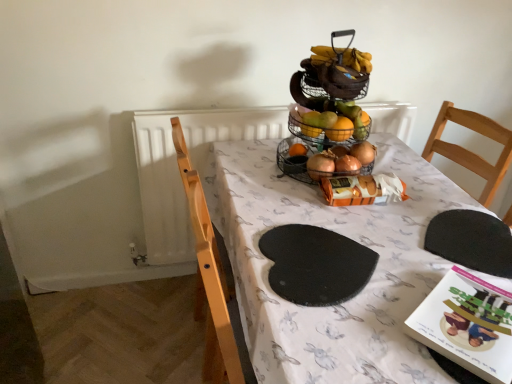
I want to click on empty space that is in between white paper book at lower right and black felt mat at center, which ranks as the first mat in left-to-right order, so click(384, 291).